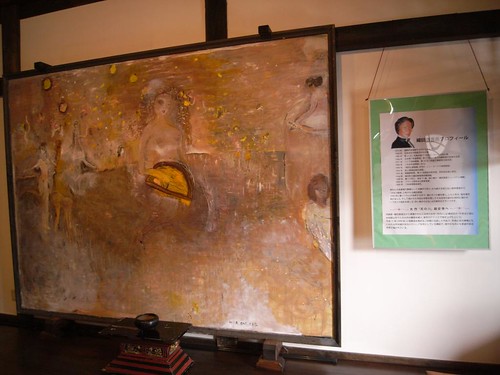
Find the location of a particular element. The width and height of the screenshot is (500, 375). tan paint is located at coordinates (299, 304), (275, 287), (296, 294), (117, 292), (160, 263).